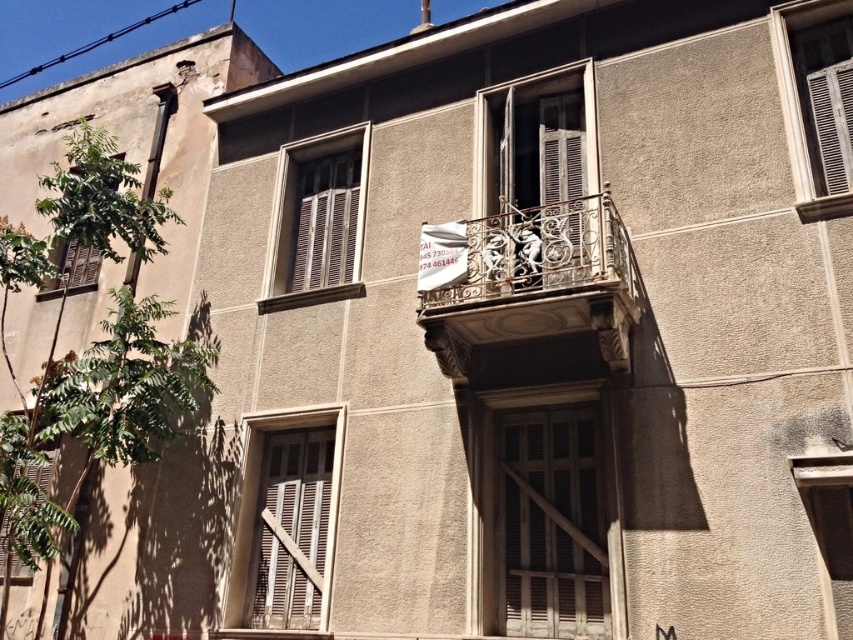
Does point (425, 323) come in front of point (354, 228)?

Yes, it is in front of point (354, 228).

Can you confirm if wrought iron balcony at center is shorter than matte wood window at center?

Yes.

Measure the distance between wrought iron balcony at center and camera.

They are 21.24 feet apart.

Identify the location of wrought iron balcony at center. (538, 284).

Is white wooden window at center shorter than white textured window at upper right?

In fact, white wooden window at center may be taller than white textured window at upper right.

Is white wooden window at center above white textured window at upper right?

No, white wooden window at center is not above white textured window at upper right.

Is point (302, 490) positioned behind point (790, 106)?

That is True.

What are the coordinates of `white wooden window at center` in the screenshot? It's located at (285, 520).

Measure the distance from white wooden window at center to wooden at center.

white wooden window at center is 6.50 feet away from wooden at center.

Who is taller, white wooden window at center or wooden at center?

Standing taller between the two is white wooden window at center.

Between point (302, 502) and point (587, 536), which one is positioned in front?

Point (587, 536)

This screenshot has height=640, width=853. Find the location of `white wooden window at center`. white wooden window at center is located at coordinates (285, 520).